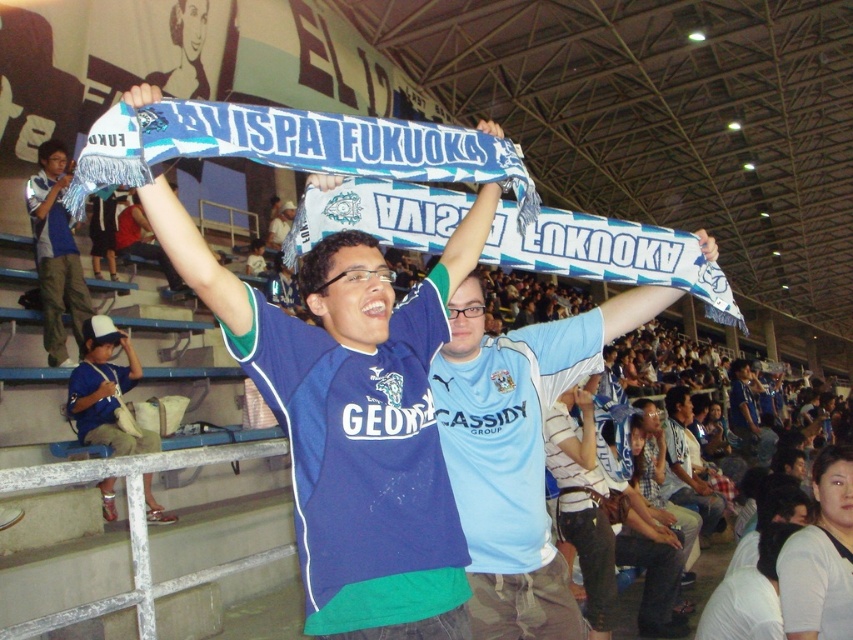
Is matte blue scarf at center positioned before matte blue scarf at left?

That is True.

Is matte blue scarf at center wider than matte blue scarf at left?

Yes, matte blue scarf at center is wider than matte blue scarf at left.

Does point (405, 561) come behind point (53, 173)?

No, it is not.

The image size is (853, 640). I want to click on matte blue scarf at center, so click(352, 420).

Can you confirm if matte blue scarf at center is taller than blue jersey at center?

Correct, matte blue scarf at center is much taller as blue jersey at center.

Is the position of matte blue scarf at center more distant than that of blue jersey at center?

No, it is not.

The height and width of the screenshot is (640, 853). What do you see at coordinates (352, 420) in the screenshot? I see `matte blue scarf at center` at bounding box center [352, 420].

Locate an element on the screen. This screenshot has height=640, width=853. matte blue scarf at center is located at coordinates (352, 420).

Who is lower down, matte blue shirt at lower left or blue jersey at center?

blue jersey at center

Find the location of a particular element. This screenshot has width=853, height=640. matte blue shirt at lower left is located at coordinates (106, 392).